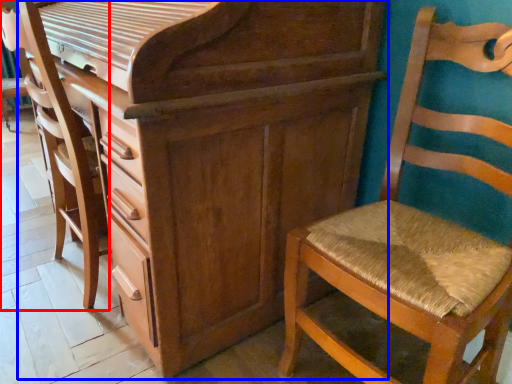
Question: Which object is closer to the camera taking this photo, swivel chair (highlighted by a red box) or chest of drawers (highlighted by a blue box)?

Choices:
 (A) swivel chair
 (B) chest of drawers

Answer: (B)